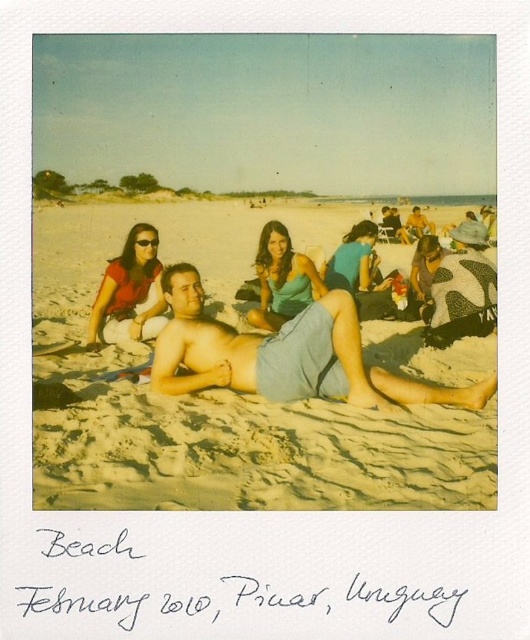
Is beige sandy beach at center above matte blue dress at center?

Yes.

What are the coordinates of `beige sandy beach at center` in the screenshot? It's located at (249, 449).

You are a GUI agent. You are given a task and a screenshot of the screen. Output one action in this format:
    pyautogui.click(x=<x>, y=<y>)
    Task: Click on the beige sandy beach at center
    The height and width of the screenshot is (640, 530).
    Given the screenshot: What is the action you would take?
    pyautogui.click(x=249, y=449)

Can you confirm if denim shorts at center is bigger than matte teal tank top at center?

Correct, denim shorts at center is larger in size than matte teal tank top at center.

In the scene shown: Does denim shorts at center come in front of matte teal tank top at center?

Yes, denim shorts at center is in front of matte teal tank top at center.

This screenshot has width=530, height=640. I want to click on denim shorts at center, so click(285, 355).

Is beige sandy beach at center to the left of matte red shirt at upper left from the viewer's perspective?

Correct, you'll find beige sandy beach at center to the left of matte red shirt at upper left.

Does beige sandy beach at center appear over matte red shirt at upper left?

Yes, beige sandy beach at center is above matte red shirt at upper left.

Is point (106, 497) more distant than point (159, 307)?

No, it is not.

Identify the location of beige sandy beach at center. This screenshot has height=640, width=530. (249, 449).